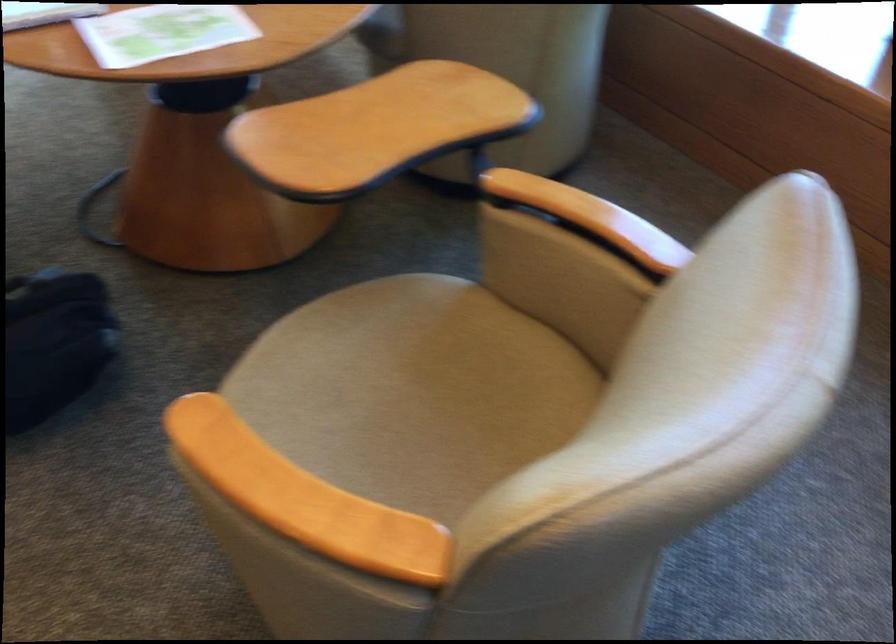
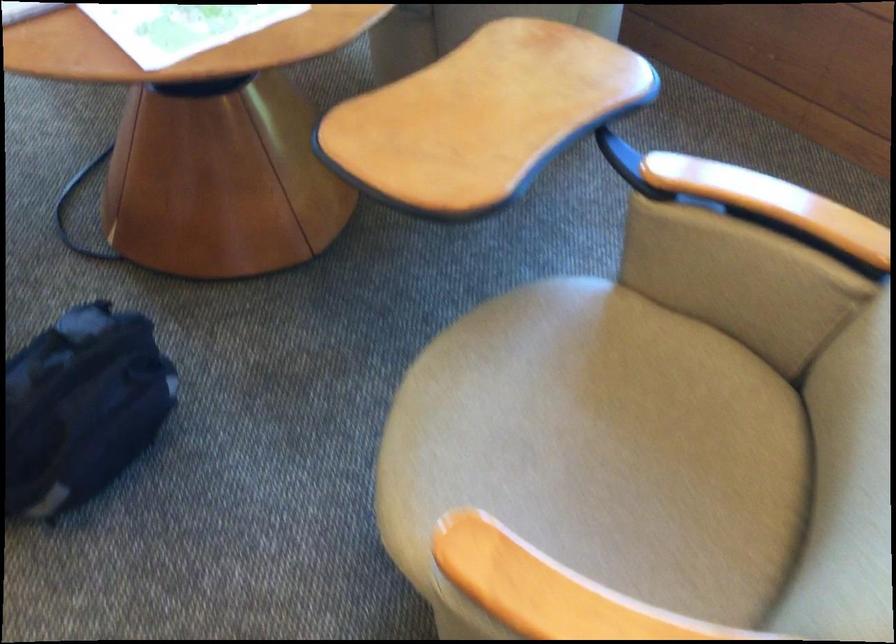
The point at (237, 460) is marked in the first image. Where is the corresponding point in the second image?

(549, 590)